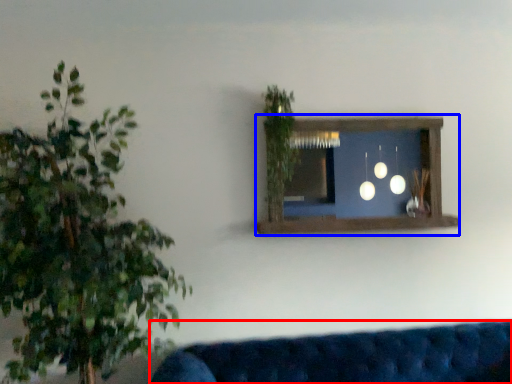
Question: Which point is further to the camera, studio couch (highlighted by a red box) or window frame (highlighted by a blue box)?

Choices:
 (A) studio couch
 (B) window frame

Answer: (B)